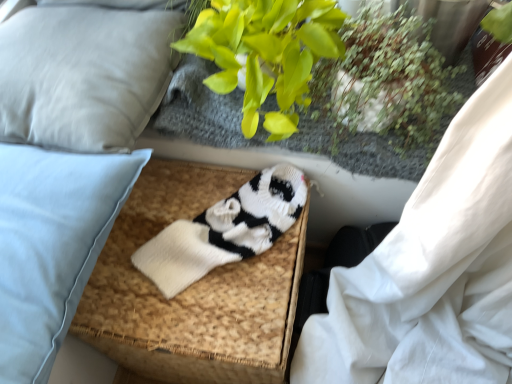
What do you see at coordinates (191, 291) in the screenshot?
I see `white knitted footrest at center` at bounding box center [191, 291].

Identify the location of green leafy plant at upper right. (393, 78).

Measure the distance between point [81,228] and camera.

The depth of point [81,228] is 24.69 inches.

What do you see at coordinates (83, 75) in the screenshot?
I see `light gray fabric pillow at upper left, the second pillow from the bottom` at bounding box center [83, 75].

The image size is (512, 384). Find the location of `white knitted footrest at center`. white knitted footrest at center is located at coordinates (191, 291).

Considering the relative sizes of green leafy plant at upper right and green leafy plant at upper center in the image provided, is green leafy plant at upper right thinner than green leafy plant at upper center?

Yes, green leafy plant at upper right is thinner than green leafy plant at upper center.

Would you consider green leafy plant at upper right to be distant from green leafy plant at upper center?

Actually, green leafy plant at upper right and green leafy plant at upper center are a little close together.

In the scene shown: Considering their positions, is green leafy plant at upper right located in front of or behind green leafy plant at upper center?

Visually, green leafy plant at upper right is located behind green leafy plant at upper center.

Is green leafy plant at upper right aimed at light gray fabric pillow at upper left, acting as the 1th pillow starting from the top?

No, green leafy plant at upper right is not aimed at light gray fabric pillow at upper left, acting as the 1th pillow starting from the top.

Does green leafy plant at upper right come behind light gray fabric pillow at upper left, the second pillow from the bottom?

No, it is in front of light gray fabric pillow at upper left, the second pillow from the bottom.

From a real-world perspective, which is physically below, green leafy plant at upper right or light gray fabric pillow at upper left, acting as the 1th pillow starting from the top?

light gray fabric pillow at upper left, acting as the 1th pillow starting from the top, is physically lower.

Is green leafy plant at upper right not close to light gray fabric pillow at upper left, acting as the 1th pillow starting from the top?

That's not correct — green leafy plant at upper right is a little close to light gray fabric pillow at upper left, acting as the 1th pillow starting from the top.

From the image's perspective, is green leafy plant at upper center located above green leafy plant at upper right?

Yes, from the image's perspective, green leafy plant at upper center is above green leafy plant at upper right.

Find the location of a particular element. The width and height of the screenshot is (512, 384). floral arrangement on the left of green leafy plant at upper right is located at coordinates (325, 64).

From a real-world perspective, is green leafy plant at upper center over green leafy plant at upper right?

Correct, in the physical world, green leafy plant at upper center is higher than green leafy plant at upper right.

Which is correct: green leafy plant at upper center is inside green leafy plant at upper right, or outside of it?

green leafy plant at upper center exists outside the volume of green leafy plant at upper right.

What's the angular difference between white knitted footrest at center and green leafy plant at upper center's facing directions?

They differ by 4.36 degrees in their facing directions.

In the scene shown: Between white knitted footrest at center and green leafy plant at upper center, which one appears on the left side from the viewer's perspective?

From the viewer's perspective, white knitted footrest at center appears more on the left side.

Is white knitted footrest at center not close to green leafy plant at upper center?

white knitted footrest at center is near green leafy plant at upper center, not far away.

Who is smaller, white knitted footrest at center or green leafy plant at upper center?

green leafy plant at upper center.

From the image's perspective, is green leafy plant at upper center on top of light gray fabric pillow at upper left, acting as the 1th pillow starting from the top?

Yes, from the image's perspective, green leafy plant at upper center is above light gray fabric pillow at upper left, acting as the 1th pillow starting from the top.

Identify the location of the 1st pillow below when counting from the green leafy plant at upper center (from the image's perspective). (83, 75).

Is green leafy plant at upper center aimed at light gray fabric pillow at upper left, acting as the 1th pillow starting from the top?

No, green leafy plant at upper center is not aimed at light gray fabric pillow at upper left, acting as the 1th pillow starting from the top.

Considering the relative sizes of green leafy plant at upper center and light gray fabric pillow at upper left, the second pillow from the bottom, in the image provided, is green leafy plant at upper center wider than light gray fabric pillow at upper left, the second pillow from the bottom,?

In fact, green leafy plant at upper center might be narrower than light gray fabric pillow at upper left, the second pillow from the bottom.

Measure the distance between white knitted footrest at center and light blue fabric pillow at left, which is counted as the 2th pillow, starting from the top.

white knitted footrest at center is 8.75 inches from light blue fabric pillow at left, which is counted as the 2th pillow, starting from the top.

Looking at this image, looking at their sizes, would you say white knitted footrest at center is wider or thinner than light blue fabric pillow at left, which is counted as the 2th pillow, starting from the top?

Clearly, white knitted footrest at center has more width compared to light blue fabric pillow at left, which is counted as the 2th pillow, starting from the top.

Is white knitted footrest at center bigger or smaller than light blue fabric pillow at left, which is counted as the 2th pillow, starting from the top?

Considering their sizes, white knitted footrest at center takes up more space than light blue fabric pillow at left, which is counted as the 2th pillow, starting from the top.

Based on the photo, is white knitted footrest at center oriented towards light blue fabric pillow at left, which is counted as the 2th pillow, starting from the top?

No, white knitted footrest at center is not oriented towards light blue fabric pillow at left, which is counted as the 2th pillow, starting from the top.

Is white knitted footrest at center in front of or behind green leafy plant at upper right in the image?

Clearly, white knitted footrest at center is behind green leafy plant at upper right.

How different are the orientations of white knitted footrest at center and green leafy plant at upper right in degrees?

The facing directions of white knitted footrest at center and green leafy plant at upper right are 1.24 degrees apart.

In the scene shown: Between white knitted footrest at center and green leafy plant at upper right, which one has less height?

With less height is green leafy plant at upper right.

From the image's perspective, between white knitted footrest at center and green leafy plant at upper right, which one is located above?

green leafy plant at upper right.

Image resolution: width=512 pixels, height=384 pixels. I want to click on plant below the green leafy plant at upper center (from the image's perspective), so click(x=393, y=78).

This screenshot has height=384, width=512. There is a green leafy plant at upper right. Identify the location of the 1st pillow below it (from a real-world perspective). (83, 75).

Looking at the image, which one is located further to light blue fabric pillow at left, which is counted as the 2th pillow, starting from the top, light gray fabric pillow at upper left, the second pillow from the bottom, or green leafy plant at upper center?

green leafy plant at upper center lies further to light blue fabric pillow at left, which is counted as the 2th pillow, starting from the top, than the other object.

Looking at the image, which one is located further to light blue fabric pillow at left, which is counted as the 2th pillow, starting from the top, light gray fabric pillow at upper left, the second pillow from the bottom, or green leafy plant at upper right?

green leafy plant at upper right is positioned further to the anchor light blue fabric pillow at left, which is counted as the 2th pillow, starting from the top.

Estimate the real-world distances between objects in this image. Which object is further from green leafy plant at upper right, green leafy plant at upper center or white knitted footrest at center?

white knitted footrest at center lies further to green leafy plant at upper right than the other object.

Which object lies further to the anchor point green leafy plant at upper right, white knitted footrest at center or green leafy plant at upper center?

white knitted footrest at center is positioned further to the anchor green leafy plant at upper right.

Based on their spatial positions, is green leafy plant at upper center or light blue fabric pillow at left, positioned as the 1th pillow in bottom-to-top order, closer to light gray fabric pillow at upper left, the second pillow from the bottom?

Based on the image, light blue fabric pillow at left, positioned as the 1th pillow in bottom-to-top order, appears to be nearer to light gray fabric pillow at upper left, the second pillow from the bottom.

When comparing their distances from green leafy plant at upper right, does light blue fabric pillow at left, positioned as the 1th pillow in bottom-to-top order, or green leafy plant at upper center seem closer?

green leafy plant at upper center lies closer to green leafy plant at upper right than the other object.

Considering their positions, is light gray fabric pillow at upper left, acting as the 1th pillow starting from the top, positioned further to green leafy plant at upper center than light blue fabric pillow at left, which is counted as the 2th pillow, starting from the top?

Based on the image, light blue fabric pillow at left, which is counted as the 2th pillow, starting from the top, appears to be further to green leafy plant at upper center.

When comparing their distances from light blue fabric pillow at left, positioned as the 1th pillow in bottom-to-top order, does green leafy plant at upper right or white knitted footrest at center seem closer?

Based on the image, white knitted footrest at center appears to be nearer to light blue fabric pillow at left, positioned as the 1th pillow in bottom-to-top order.

Find the location of a particular element. This screenshot has width=512, height=384. pillow located between light gray fabric pillow at upper left, the second pillow from the bottom, and green leafy plant at upper center in the left-right direction is located at coordinates (51, 245).

In order to click on the footrest situated between light blue fabric pillow at left, positioned as the 1th pillow in bottom-to-top order, and green leafy plant at upper right from left to right in this screenshot , I will do `click(191, 291)`.

The image size is (512, 384). Identify the location of plant between green leafy plant at upper center and white knitted footrest at center vertically. (393, 78).

Where is `floral arrangement located between light blue fabric pillow at left, positioned as the 1th pillow in bottom-to-top order, and green leafy plant at upper right in the left-right direction`? This screenshot has height=384, width=512. floral arrangement located between light blue fabric pillow at left, positioned as the 1th pillow in bottom-to-top order, and green leafy plant at upper right in the left-right direction is located at coordinates (325, 64).